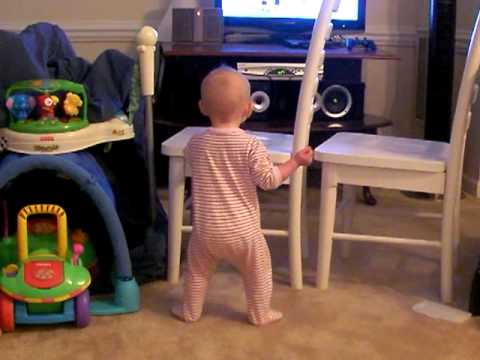
The width and height of the screenshot is (480, 360). Identify the location of dvd player. [x=271, y=79].